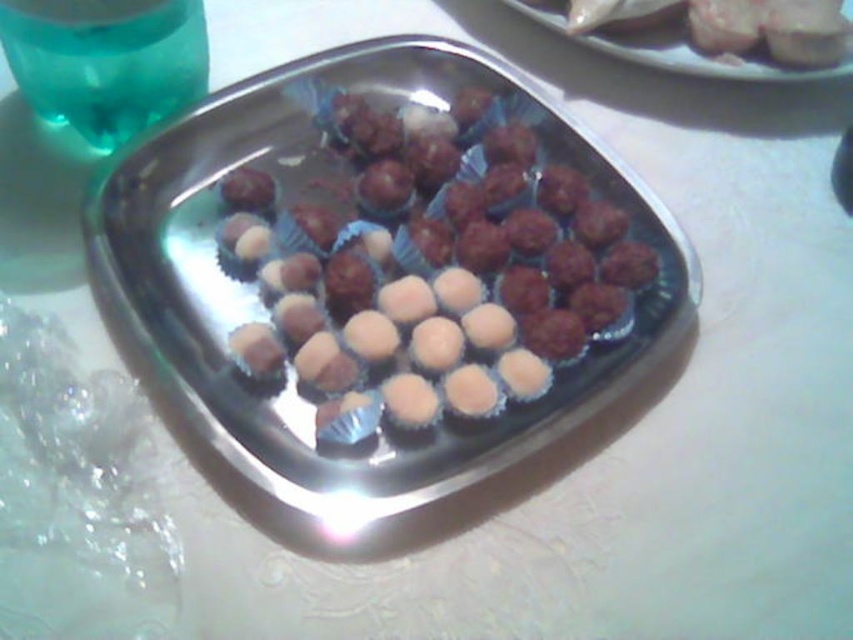
Question: Can you confirm if shiny silver tray at center is thinner than matte silver platter at upper right?

Choices:
 (A) no
 (B) yes

Answer: (A)

Question: Which point is closer to the camera?

Choices:
 (A) matte silver platter at upper right
 (B) shiny silver tray at center

Answer: (B)

Question: Does shiny silver tray at center have a smaller size compared to matte silver platter at upper right?

Choices:
 (A) no
 (B) yes

Answer: (A)

Question: Does shiny silver tray at center appear on the right side of matte silver platter at upper right?

Choices:
 (A) yes
 (B) no

Answer: (B)

Question: Which point is closer to the camera?

Choices:
 (A) matte silver platter at upper right
 (B) shiny silver tray at center

Answer: (B)

Question: Which point appears closest to the camera in this image?

Choices:
 (A) (154, 349)
 (B) (780, 70)

Answer: (A)